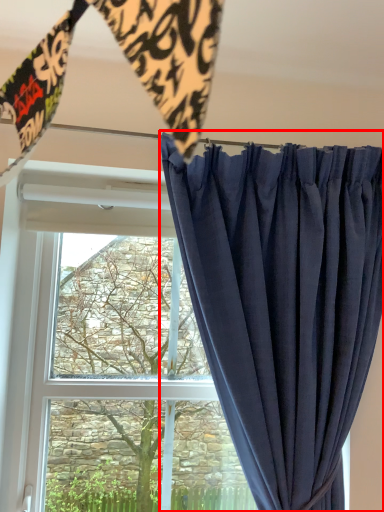
Question: From the image's perspective, what is the correct spatial relationship of curtain (annotated by the red box) in relation to tree?

Choices:
 (A) below
 (B) above

Answer: (B)